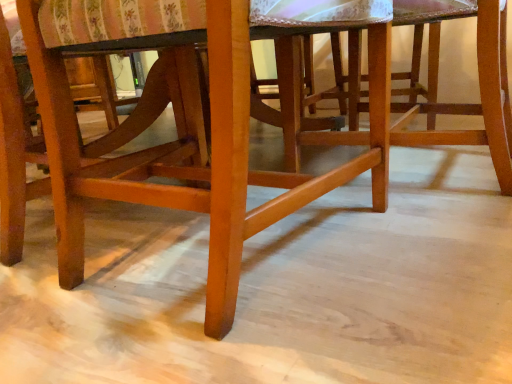
Question: Is wooden chair at center further to the viewer compared to wooden stool at center?

Choices:
 (A) yes
 (B) no

Answer: (B)

Question: Is wooden chair at center turned away from wooden stool at center?

Choices:
 (A) yes
 (B) no

Answer: (B)

Question: Can you confirm if wooden chair at center is smaller than wooden stool at center?

Choices:
 (A) no
 (B) yes

Answer: (A)

Question: Could you tell me if wooden chair at center is facing wooden stool at center?

Choices:
 (A) no
 (B) yes

Answer: (B)

Question: Is wooden chair at center outside of wooden stool at center?

Choices:
 (A) yes
 (B) no

Answer: (A)

Question: From a real-world perspective, is wooden chair at center positioned over wooden stool at center based on gravity?

Choices:
 (A) yes
 (B) no

Answer: (A)

Question: Are wooden stool at center and wooden chair at center located far from each other?

Choices:
 (A) yes
 (B) no

Answer: (B)

Question: From the image's perspective, does wooden stool at center appear higher than wooden chair at center?

Choices:
 (A) no
 (B) yes

Answer: (B)

Question: Considering the relative positions of wooden stool at center and wooden chair at center in the image provided, is wooden stool at center behind wooden chair at center?

Choices:
 (A) yes
 (B) no

Answer: (A)

Question: Does wooden stool at center have a greater height compared to wooden chair at center?

Choices:
 (A) no
 (B) yes

Answer: (A)

Question: Is wooden stool at center at the right side of wooden chair at center?

Choices:
 (A) no
 (B) yes

Answer: (B)

Question: Is wooden stool at center oriented towards wooden chair at center?

Choices:
 (A) yes
 (B) no

Answer: (B)

Question: From their relative heights in the image, would you say wooden chair at center is taller or shorter than wooden stool at center?

Choices:
 (A) short
 (B) tall

Answer: (B)